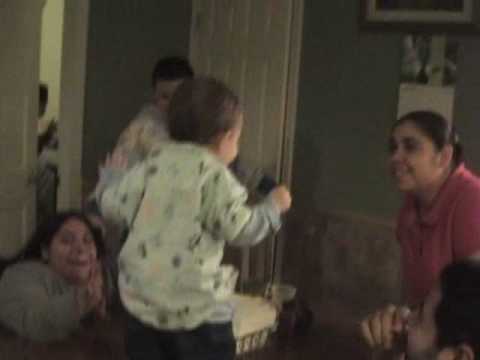
The height and width of the screenshot is (360, 480). Find the location of `papers on wall`. papers on wall is located at coordinates (430, 100).